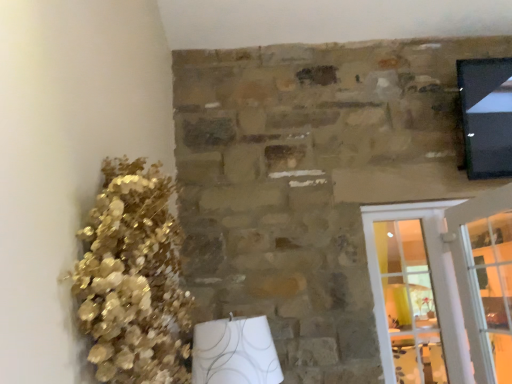
Where is `white glass screen door at right`? Image resolution: width=512 pixels, height=384 pixels. white glass screen door at right is located at coordinates click(x=443, y=288).

Locate an element on the screen. clear glass door at lower right is located at coordinates (485, 279).

Is gold metallic floral arrangement at left with clear glass door at lower right?

They are not placed beside each other.

Is gold metallic floral arrangement at left facing away from clear glass door at lower right?

No, clear glass door at lower right is not at the back of gold metallic floral arrangement at left.

Does point (164, 246) come closer to viewer compared to point (493, 328)?

Yes, point (164, 246) is closer to viewer.

From a real-world perspective, is gold metallic floral arrangement at left on top of clear glass door at lower right?

Yes, from a real-world perspective, gold metallic floral arrangement at left is on top of clear glass door at lower right.

Does gold metallic floral arrangement at left touch white glass screen door at right?

There is a gap between gold metallic floral arrangement at left and white glass screen door at right.

Which is in front, gold metallic floral arrangement at left or white glass screen door at right?

gold metallic floral arrangement at left is more forward.

Is gold metallic floral arrangement at left looking in the opposite direction of white glass screen door at right?

No, gold metallic floral arrangement at left's orientation is not away from white glass screen door at right.

Considering the relative sizes of gold metallic floral arrangement at left and white glass screen door at right in the image provided, is gold metallic floral arrangement at left smaller than white glass screen door at right?

Incorrect, gold metallic floral arrangement at left is not smaller in size than white glass screen door at right.

Does white glass screen door at right have a smaller size compared to clear glass door at lower right?

Yes.

Is white glass screen door at right to the right of clear glass door at lower right from the viewer's perspective?

No, white glass screen door at right is not to the right of clear glass door at lower right.

From the image's perspective, is white glass screen door at right beneath clear glass door at lower right?

Yes, from the image's perspective, white glass screen door at right is beneath clear glass door at lower right.

Considering the positions of point (497, 311) and point (508, 255), is point (497, 311) closer or farther from the camera than point (508, 255)?

Point (497, 311) is positioned farther from the camera compared to point (508, 255).

Which object is wider, clear glass door at lower right or gold metallic floral arrangement at left?

Wider between the two is gold metallic floral arrangement at left.

From their relative heights in the image, would you say clear glass door at lower right is taller or shorter than gold metallic floral arrangement at left?

clear glass door at lower right is taller than gold metallic floral arrangement at left.

Is clear glass door at lower right facing towards gold metallic floral arrangement at left?

No, clear glass door at lower right is not aimed at gold metallic floral arrangement at left.

Is clear glass door at lower right not close to gold metallic floral arrangement at left?

Indeed, clear glass door at lower right is not near gold metallic floral arrangement at left.

Considering the sizes of clear glass door at lower right and white glass screen door at right in the image, is clear glass door at lower right taller or shorter than white glass screen door at right?

Considering their sizes, clear glass door at lower right has less height than white glass screen door at right.

Could you tell me if clear glass door at lower right is facing white glass screen door at right?

No, clear glass door at lower right is not oriented towards white glass screen door at right.

Is clear glass door at lower right far from white glass screen door at right?

No.

Measure the distance from white glass screen door at right to gold metallic floral arrangement at left.

white glass screen door at right is 1.58 meters from gold metallic floral arrangement at left.

Are white glass screen door at right and gold metallic floral arrangement at left beside each other?

white glass screen door at right is not next to gold metallic floral arrangement at left, and they're not touching.

Is white glass screen door at right looking in the opposite direction of gold metallic floral arrangement at left?

No, gold metallic floral arrangement at left is not at the back of white glass screen door at right.

Is white glass screen door at right outside of gold metallic floral arrangement at left?

Indeed, white glass screen door at right is completely outside gold metallic floral arrangement at left.

At what (x,y) coordinates should I click in order to perform the action: click on glass door below the gold metallic floral arrangement at left (from the image's perspective). Please return your answer as a coordinate pair (x, y). The height and width of the screenshot is (384, 512). Looking at the image, I should click on (485, 279).

You are a GUI agent. You are given a task and a screenshot of the screen. Output one action in this format:
    pyautogui.click(x=<x>, y=<y>)
    Task: Click on the floral arrangement in front of the white glass screen door at right
    Image resolution: width=512 pixels, height=384 pixels.
    Given the screenshot: What is the action you would take?
    pyautogui.click(x=133, y=279)

Estimate the real-world distances between objects in this image. Which object is further from gold metallic floral arrangement at left, clear glass door at lower right or white glass screen door at right?

The object further to gold metallic floral arrangement at left is clear glass door at lower right.

From the image, which object appears to be nearer to white glass screen door at right, gold metallic floral arrangement at left or clear glass door at lower right?

The object closer to white glass screen door at right is clear glass door at lower right.

Looking at the image, which one is located further to white glass screen door at right, clear glass door at lower right or gold metallic floral arrangement at left?

Based on the image, gold metallic floral arrangement at left appears to be further to white glass screen door at right.

From the image, which object appears to be nearer to clear glass door at lower right, white glass screen door at right or gold metallic floral arrangement at left?

white glass screen door at right is positioned closer to the anchor clear glass door at lower right.

Based on their spatial positions, is gold metallic floral arrangement at left or white glass screen door at right closer to clear glass door at lower right?

white glass screen door at right is closer to clear glass door at lower right.

From the image, which object appears to be farther from gold metallic floral arrangement at left, white glass screen door at right or clear glass door at lower right?

Based on the image, clear glass door at lower right appears to be further to gold metallic floral arrangement at left.

You are a GUI agent. You are given a task and a screenshot of the screen. Output one action in this format:
    pyautogui.click(x=<x>, y=<y>)
    Task: Click on the screen door between gold metallic floral arrangement at left and clear glass door at lower right from left to right
    This screenshot has height=384, width=512.
    Given the screenshot: What is the action you would take?
    pyautogui.click(x=443, y=288)